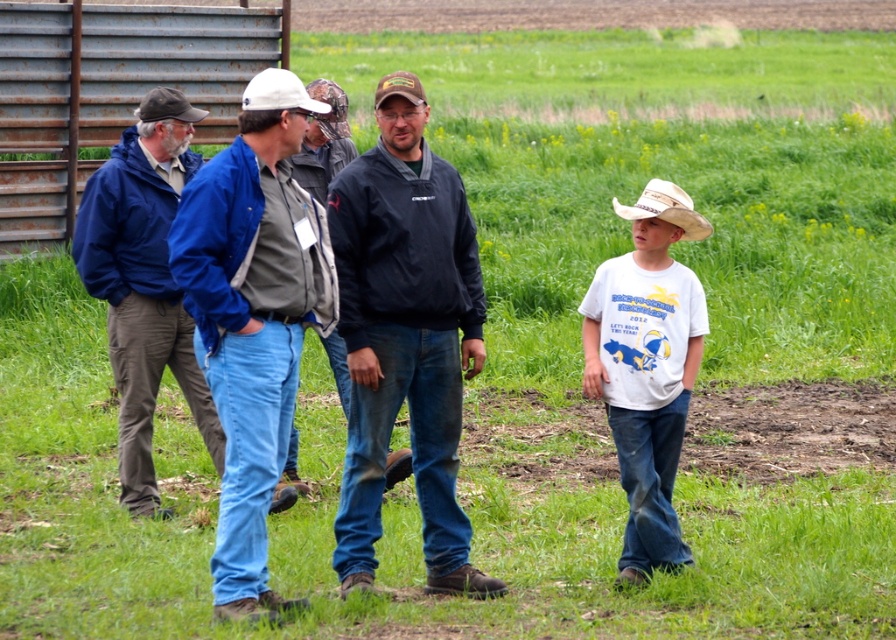
You are standing at the point with coordinates point (164, 100) and want to walk to the barn on the left side of the frame. There is a point at point (685, 387) in your path. Will this point be in front of or behind you as you walk towards the barn?

The point at point (685, 387) is in front of point (164, 100), so as you walk towards the barn, the point at point (685, 387) will be in front of you.